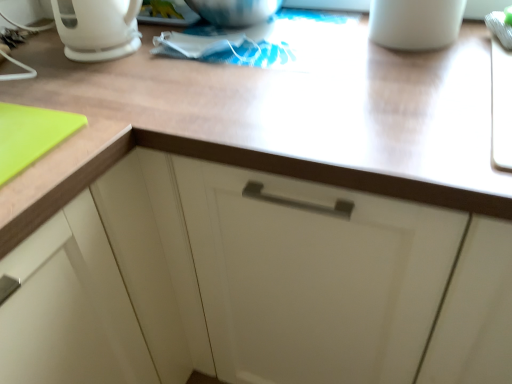
In order to click on vacant area on top of wooden at upper center (from a real-world perspective) in this screenshot , I will do `click(269, 66)`.